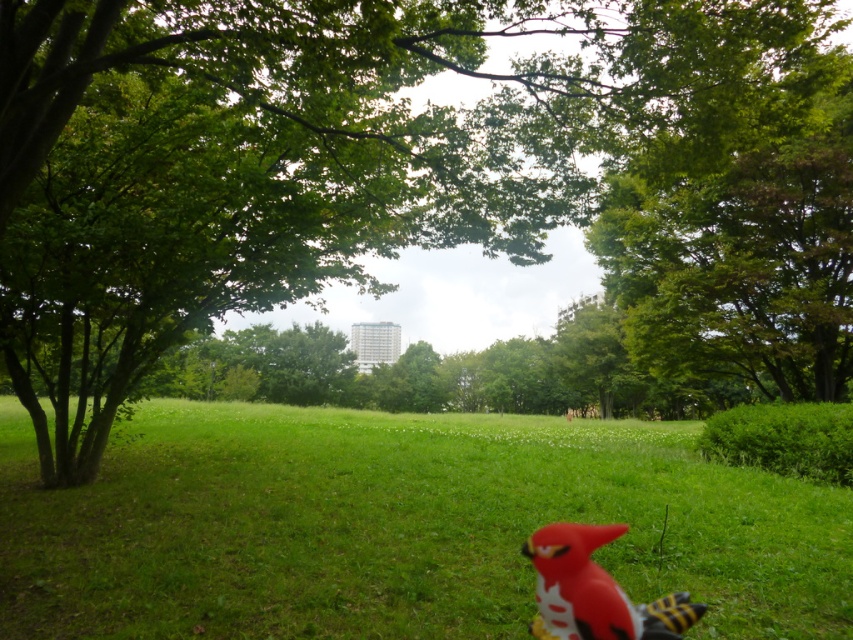
Question: Is green leafy tree at upper right positioned before rubber bird at lower center?

Choices:
 (A) yes
 (B) no

Answer: (B)

Question: Estimate the real-world distances between objects in this image. Which object is farther from the green leafy tree at upper right?

Choices:
 (A) rubber bird at lower center
 (B) green grassy field at center

Answer: (A)

Question: Which point is farther from the camera taking this photo?

Choices:
 (A) (415, 484)
 (B) (554, 544)
 (C) (683, 205)

Answer: (C)

Question: Does green grassy field at center appear on the right side of green leafy tree at upper right?

Choices:
 (A) yes
 (B) no

Answer: (B)

Question: Which object is farther from the camera taking this photo?

Choices:
 (A) green grassy field at center
 (B) green leafy tree at upper right

Answer: (B)

Question: Considering the relative positions of green leafy tree at upper right and rubber bird at lower center in the image provided, where is green leafy tree at upper right located with respect to rubber bird at lower center?

Choices:
 (A) right
 (B) left

Answer: (A)